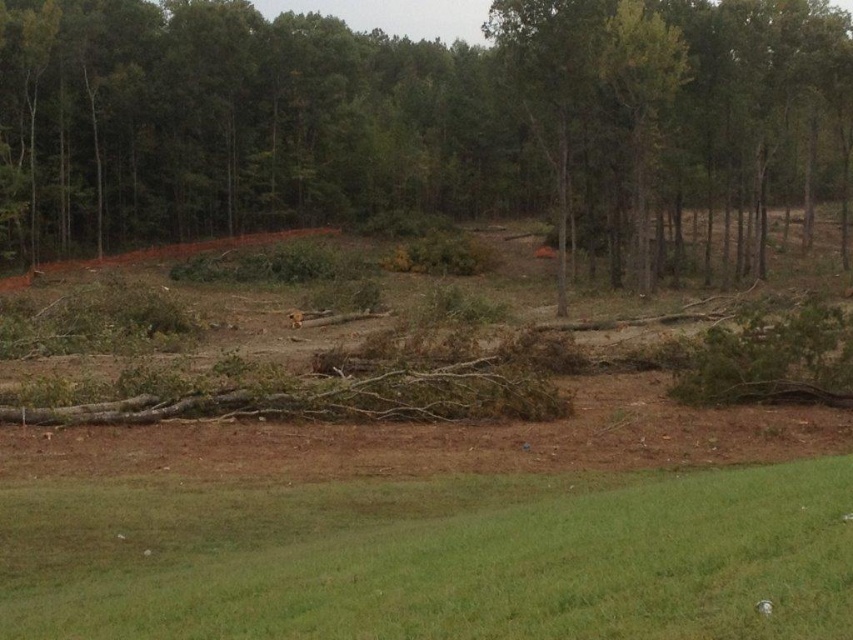
Can you confirm if brown wood log at center is positioned to the right of green grass at lower center?

Incorrect, brown wood log at center is not on the right side of green grass at lower center.

Is point (486, 141) closer to camera compared to point (451, 595)?

No, (486, 141) is behind (451, 595).

The height and width of the screenshot is (640, 853). Find the location of `brown wood log at center`. brown wood log at center is located at coordinates (425, 125).